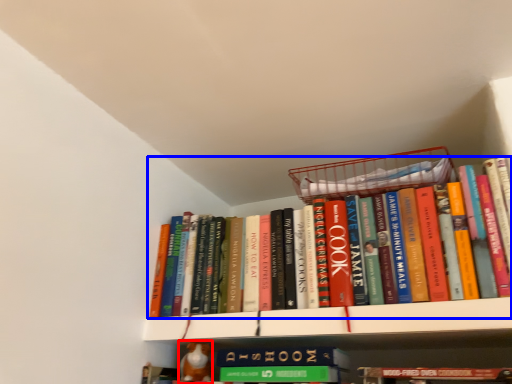
Question: Which of the following is the farthest to the observer, toy (highlighted by a red box) or book (highlighted by a blue box)?

Choices:
 (A) toy
 (B) book

Answer: (A)